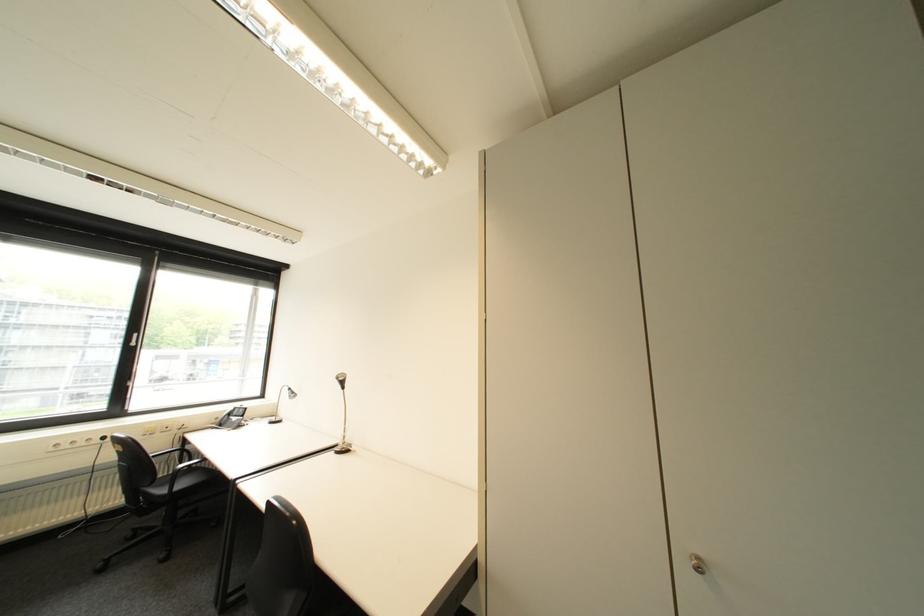
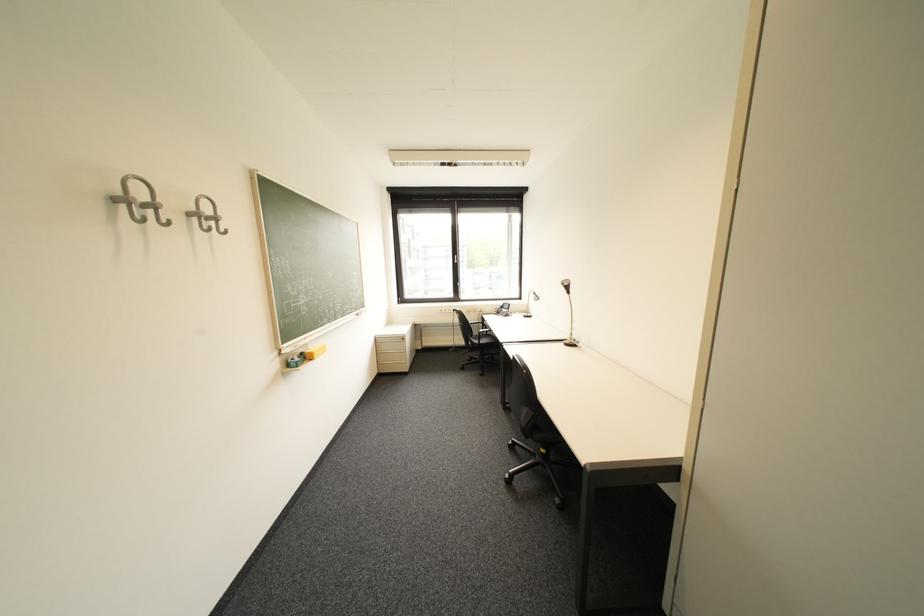
In the second image, find the point that corresponds to pixel 268 394 in the first image.

(528, 297)